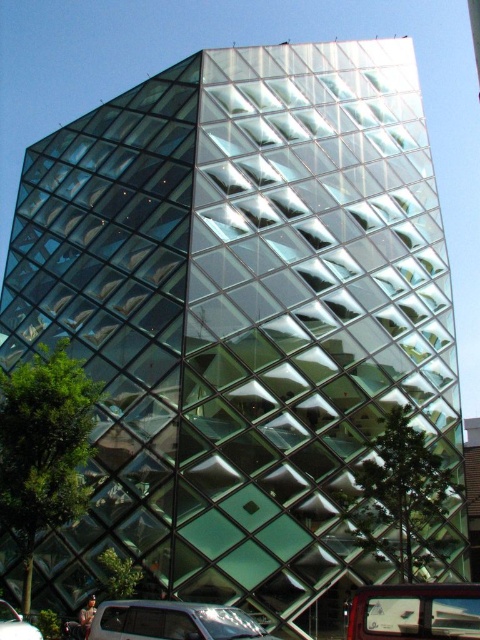
You are standing at the entrance of the modern building and want to park your metallic silver car at lower right. According to the building layout, where should you position your car?

The metallic silver car at lower right should be positioned at point (416,611) as specified in the building layout.

You are standing in front of the modern building and see a point marked at coordinates (416,611). What object is located at that point?

The point at coordinates (416,611) indicates a metallic silver car at lower right.

You are standing at a point 20.17 meters away from the point labeled as point (213, 634) on the building facade. If you want to take a photo of the entire building, would you need to move closer or farther away?

Since you are already 20.17 meters away from point (213, 634), which is part of the building, you need to move farther away to capture the entire structure in one photo.